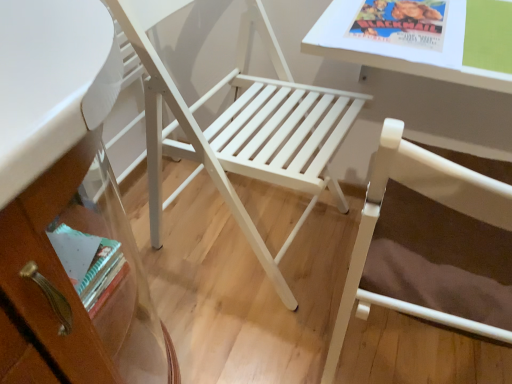
Question: Is white glossy table at upper right bigger or smaller than white wood chair at center, which is the second chair from right to left?

Choices:
 (A) small
 (B) big

Answer: (A)

Question: Considering the positions of point (333, 8) and point (308, 178), is point (333, 8) closer or farther from the camera than point (308, 178)?

Choices:
 (A) farther
 (B) closer

Answer: (B)

Question: Based on their relative distances, which object is farther from the white wood chair at center, which ranks as the 1th chair in right-to-left order?

Choices:
 (A) white wood chair at center, which is the second chair from right to left
 (B) white glossy table at upper right

Answer: (A)

Question: Which is farther from the white wood chair at center, placed as the first chair when sorted from left to right?

Choices:
 (A) white glossy table at upper right
 (B) white wood chair at center, which is counted as the second chair, starting from the left

Answer: (B)